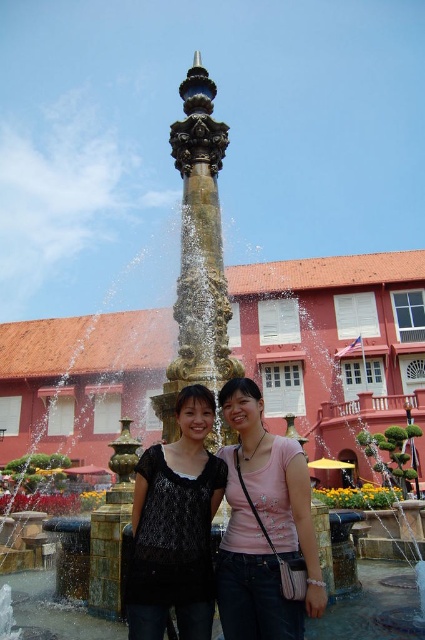
Between matte black shirt at center and matte black top at center, which one appears on the left side from the viewer's perspective?

matte black top at center

Can you confirm if matte black shirt at center is positioned to the left of matte black top at center?

Incorrect, matte black shirt at center is not on the left side of matte black top at center.

Between point (246, 456) and point (198, 547), which one is positioned behind?

Positioned behind is point (246, 456).

The height and width of the screenshot is (640, 425). Find the location of `matte black shirt at center`. matte black shirt at center is located at coordinates (263, 525).

How far apart are matte black shirt at center and gold textured fountain at center?

matte black shirt at center is 7.16 meters from gold textured fountain at center.

Can you confirm if matte black shirt at center is bigger than gold textured fountain at center?

Incorrect, matte black shirt at center is not larger than gold textured fountain at center.

Locate an element on the screen. matte black shirt at center is located at coordinates (263, 525).

Where is `matte black shirt at center`? matte black shirt at center is located at coordinates (263, 525).

Is matte black top at center taller than gold textured fountain at center?

No, matte black top at center is not taller than gold textured fountain at center.

Based on the photo, who is more distant from viewer, (172, 572) or (184, 371)?

The point (184, 371) is behind.

At what (x,y) coordinates should I click in order to perform the action: click on matte black top at center. Please return your answer as a coordinate pair (x, y). Looking at the image, I should click on (175, 525).